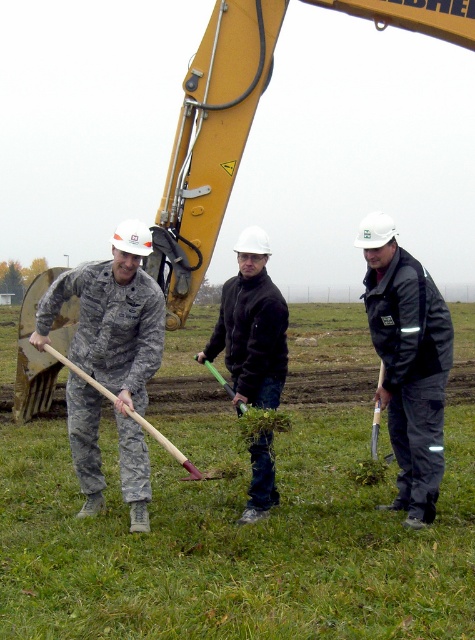
Between green grass at center and wooden handle shovel at left, which one has more height?

Standing taller between the two is wooden handle shovel at left.

From the picture: Does green grass at center come behind wooden handle shovel at left?

No, it is not.

Which is in front, point (79, 573) or point (178, 460)?

Point (79, 573) is in front.

This screenshot has width=475, height=640. I want to click on green grass at center, so click(x=239, y=513).

Where is `black matte jacket at right`? The width and height of the screenshot is (475, 640). black matte jacket at right is located at coordinates (408, 362).

Is point (360, 241) positioned in front of point (234, 308)?

Yes, it is in front of point (234, 308).

I want to click on black matte jacket at right, so click(x=408, y=362).

Identify the location of black matte jacket at right. This screenshot has width=475, height=640. (408, 362).

Which of these two, green grass at center or wooden shovel at center, stands shorter?

wooden shovel at center is shorter.

Where is `green grass at center`? green grass at center is located at coordinates (239, 513).